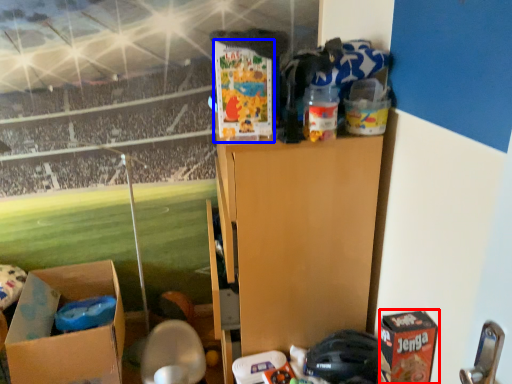
Question: Which object appears farthest to the camera in this image, cardboard box (highlighted by a red box) or box (highlighted by a blue box)?

Choices:
 (A) cardboard box
 (B) box

Answer: (B)